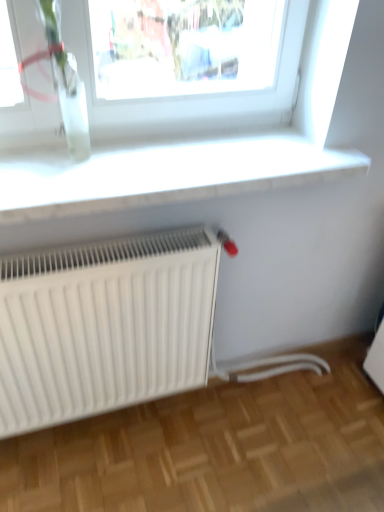
Question: Is the position of clear glass vase at upper left more distant than that of white matte radiator at lower left?

Choices:
 (A) no
 (B) yes

Answer: (A)

Question: Is clear glass vase at upper left bigger than white matte radiator at lower left?

Choices:
 (A) yes
 (B) no

Answer: (B)

Question: Does clear glass vase at upper left turn towards white matte radiator at lower left?

Choices:
 (A) no
 (B) yes

Answer: (A)

Question: Can you confirm if clear glass vase at upper left is thinner than white matte radiator at lower left?

Choices:
 (A) no
 (B) yes

Answer: (B)

Question: Would you say clear glass vase at upper left is a long distance from white matte radiator at lower left?

Choices:
 (A) yes
 (B) no

Answer: (B)

Question: Is clear glass vase at upper left not inside white matte radiator at lower left?

Choices:
 (A) no
 (B) yes

Answer: (B)

Question: From a real-world perspective, is white matte radiator at lower left physically above clear glass vase at upper left?

Choices:
 (A) yes
 (B) no

Answer: (B)

Question: Is white matte radiator at lower left positioned beyond the bounds of clear glass vase at upper left?

Choices:
 (A) no
 (B) yes

Answer: (B)

Question: Would you say white matte radiator at lower left is a long distance from clear glass vase at upper left?

Choices:
 (A) no
 (B) yes

Answer: (A)

Question: Does white matte radiator at lower left have a smaller size compared to clear glass vase at upper left?

Choices:
 (A) no
 (B) yes

Answer: (A)

Question: Is white matte radiator at lower left at the right side of clear glass vase at upper left?

Choices:
 (A) yes
 (B) no

Answer: (A)

Question: Is white matte radiator at lower left positioned with its back to clear glass vase at upper left?

Choices:
 (A) yes
 (B) no

Answer: (B)

Question: Does white smooth window sill at upper center appear on the right side of clear glass vase at upper left?

Choices:
 (A) no
 (B) yes

Answer: (B)